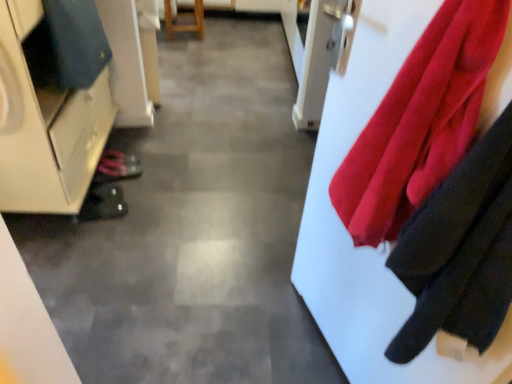
Image resolution: width=512 pixels, height=384 pixels. I want to click on free spot in front of wooden stool at center, so click(180, 49).